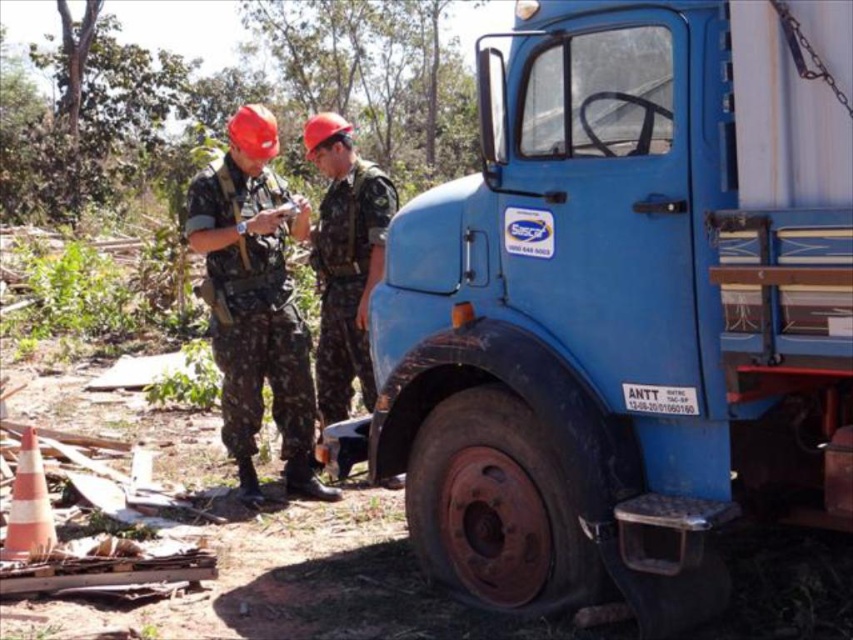
Which of these two, blue matte truck at center or camouflage fabric uniform at center, stands taller?

blue matte truck at center is taller.

Does point (668, 448) come farther from viewer compared to point (347, 353)?

No, it is not.

Find the location of a particular element. The width and height of the screenshot is (853, 640). blue matte truck at center is located at coordinates (624, 308).

Is blue matte truck at center wider than camouflage fabric uniform at left?

Correct, the width of blue matte truck at center exceeds that of camouflage fabric uniform at left.

Is point (622, 563) closer to viewer compared to point (305, 396)?

Yes, point (622, 563) is in front of point (305, 396).

You are a GUI agent. You are given a task and a screenshot of the screen. Output one action in this format:
    pyautogui.click(x=<x>, y=<y>)
    Task: Click on the blue matte truck at center
    The height and width of the screenshot is (640, 853).
    Given the screenshot: What is the action you would take?
    pyautogui.click(x=624, y=308)

Who is taller, camouflage fabric uniform at left or camouflage fabric uniform at center?

Standing taller between the two is camouflage fabric uniform at left.

Does camouflage fabric uniform at left have a greater width compared to camouflage fabric uniform at center?

Yes, camouflage fabric uniform at left is wider than camouflage fabric uniform at center.

Is point (230, 257) in front of point (389, 205)?

Yes, it is in front of point (389, 205).

The width and height of the screenshot is (853, 640). I want to click on camouflage fabric uniform at left, so click(x=258, y=340).